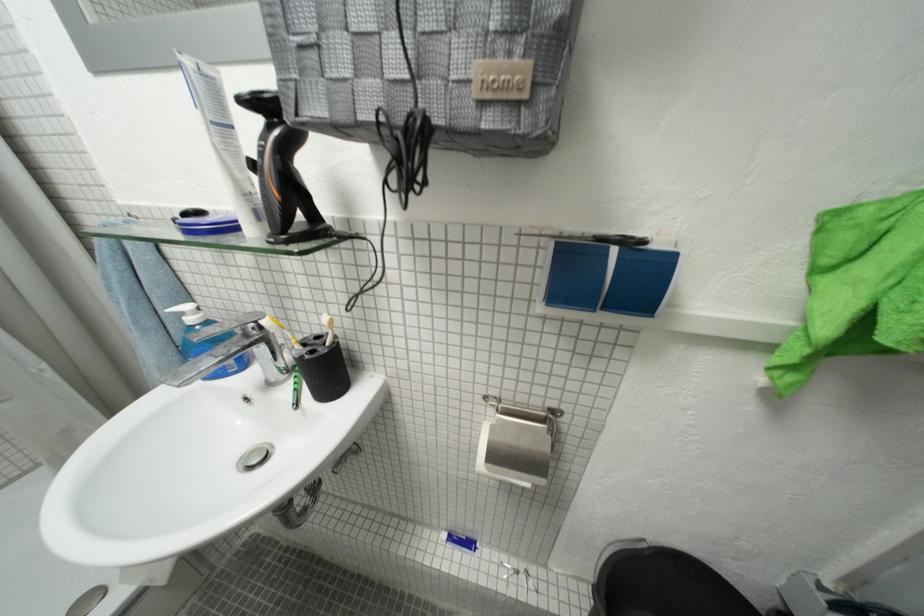
What do you see at coordinates (283, 331) in the screenshot?
I see `the yellow toothbrush` at bounding box center [283, 331].